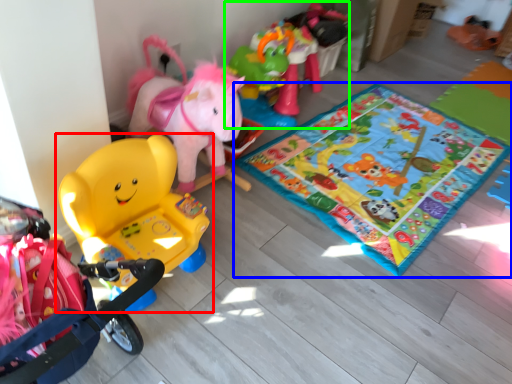
Question: Which object is the closest to the toy (highlighted by a red box)? Choose among these: yoga mat (highlighted by a blue box) or toy (highlighted by a green box).

Choices:
 (A) yoga mat
 (B) toy

Answer: (A)